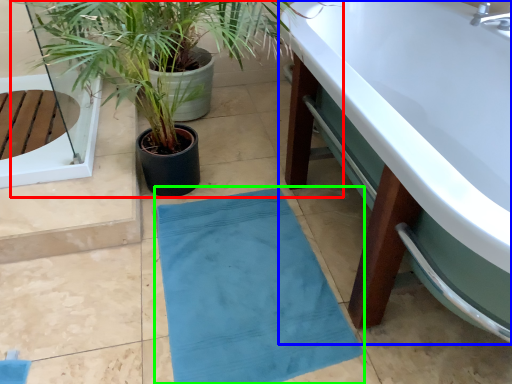
Question: Which is farther away from houseplant (highlighted by a red box)? bathtub (highlighted by a blue box) or bath mat (highlighted by a green box)?

Choices:
 (A) bathtub
 (B) bath mat

Answer: (A)